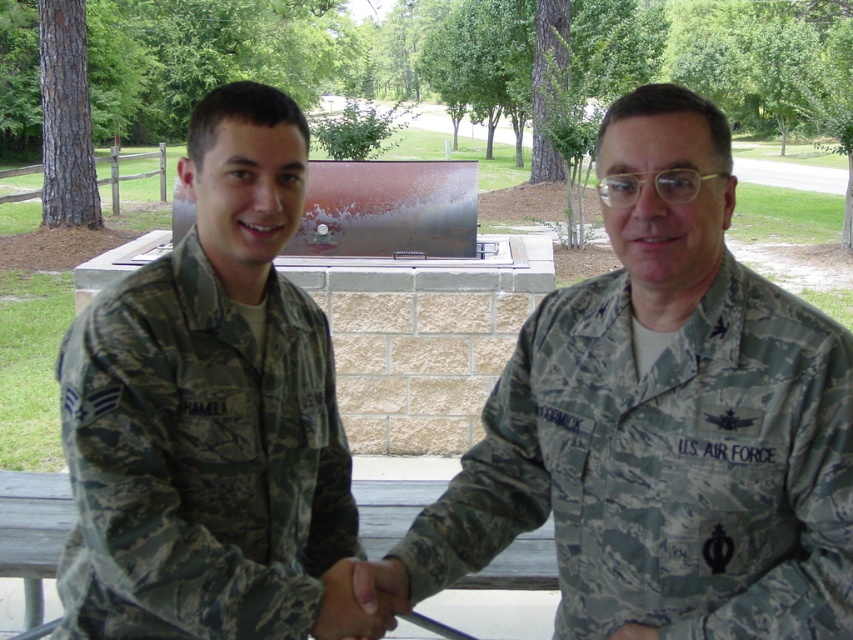
Based on the photo, is camouflage uniform at center below camouflage uniform at left?

Yes.

Who is more distant from viewer, (717, 109) or (264, 371)?

Point (264, 371)

Where is `camouflage uniform at center`? Image resolution: width=853 pixels, height=640 pixels. camouflage uniform at center is located at coordinates (660, 420).

I want to click on camouflage uniform at center, so click(x=660, y=420).